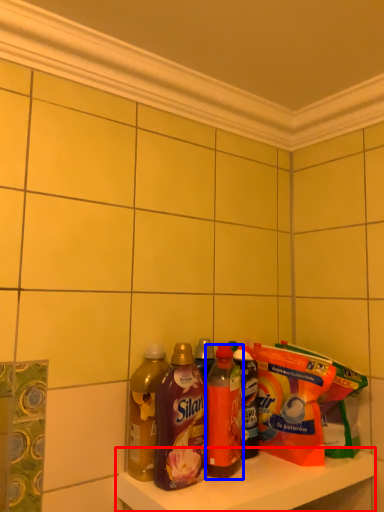
Question: Which object is further to the camera taking this photo, shelf (highlighted by a red box) or bottle (highlighted by a blue box)?

Choices:
 (A) shelf
 (B) bottle

Answer: (B)